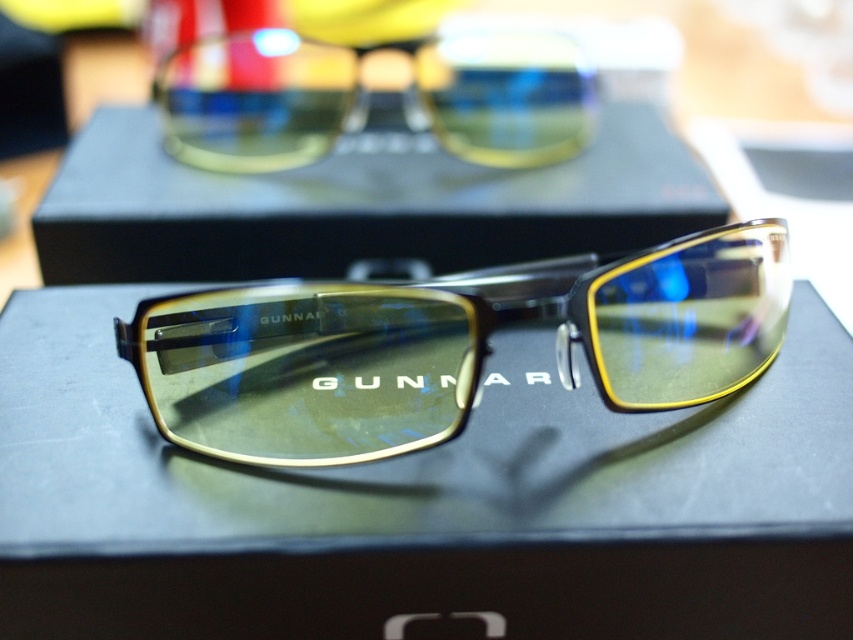
Question: Which object appears farthest from the camera in this image?

Choices:
 (A) matte gold frame at center
 (B) black matte box at center

Answer: (B)

Question: Which point is farther to the camera?

Choices:
 (A) matte gold frame at center
 (B) yellow-tinted plastic goggles at upper center
 (C) black matte box at center

Answer: (B)

Question: Is black matte box at center behind yellow-tinted plastic goggles at upper center?

Choices:
 (A) no
 (B) yes

Answer: (A)

Question: Among these objects, which one is nearest to the camera?

Choices:
 (A) matte gold frame at center
 (B) black matte box at center

Answer: (A)

Question: Does matte gold frame at center have a lesser width compared to yellow-tinted plastic goggles at upper center?

Choices:
 (A) no
 (B) yes

Answer: (A)

Question: Is matte gold frame at center smaller than black matte box at center?

Choices:
 (A) yes
 (B) no

Answer: (A)